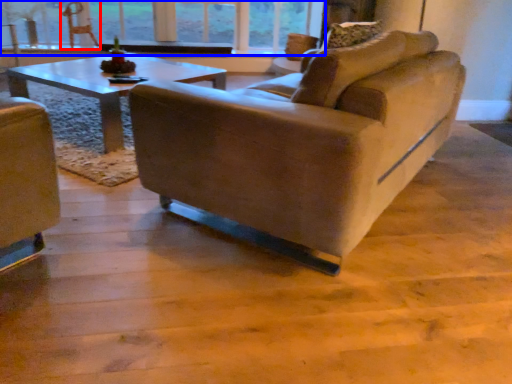
Question: Which point is closer to the camera, swivel chair (highlighted by a red box) or window (highlighted by a blue box)?

Choices:
 (A) swivel chair
 (B) window

Answer: (A)